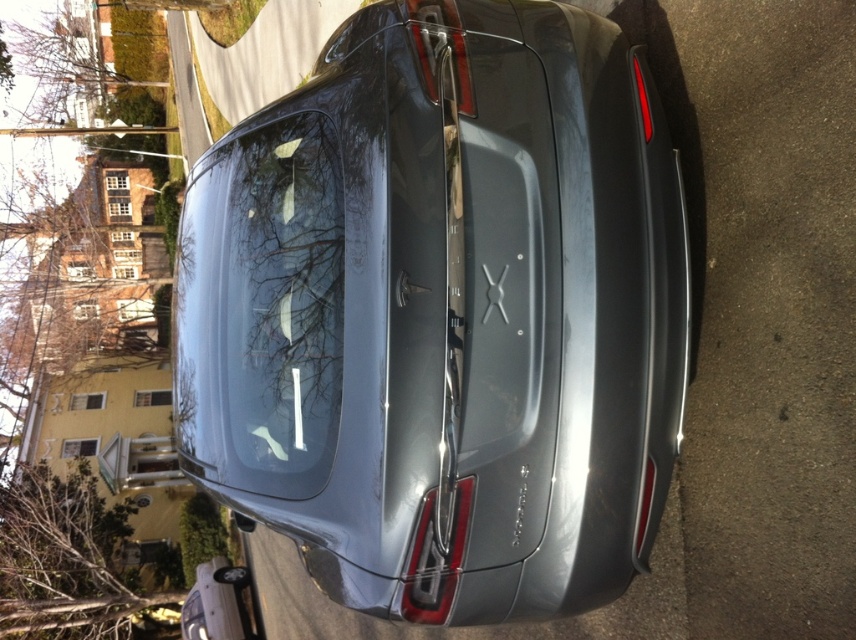
Is satin metallic car at center smaller than transparent glass windshield at center?

No, satin metallic car at center is not smaller than transparent glass windshield at center.

Does point (657, 307) lie in front of point (321, 124)?

Yes, it is.

Who is more forward, (486, 612) or (293, 328)?

Point (293, 328) is in front.

Find the location of a particular element. This screenshot has height=640, width=856. satin metallic car at center is located at coordinates (443, 314).